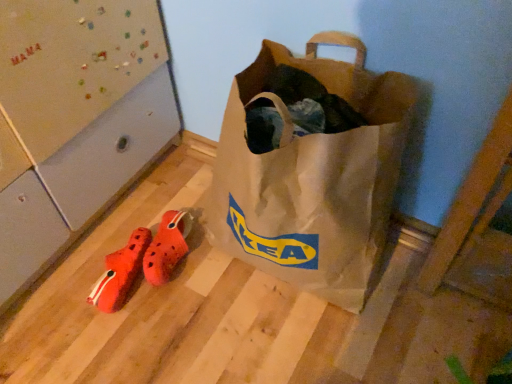
Question: Relative to matte brown paper bag at center, is orange rubber clogs at lower left in front or behind?

Choices:
 (A) front
 (B) behind

Answer: (B)

Question: In terms of height, does orange rubber clogs at lower left look taller or shorter compared to matte brown paper bag at center?

Choices:
 (A) short
 (B) tall

Answer: (A)

Question: Which object is the closest to the orange fabric shoe at lower left?

Choices:
 (A) orange rubber clogs at lower left
 (B) matte brown paper bag at center

Answer: (A)

Question: Which is nearer to the orange fabric shoe at lower left?

Choices:
 (A) matte brown paper bag at center
 (B) orange rubber clogs at lower left

Answer: (B)